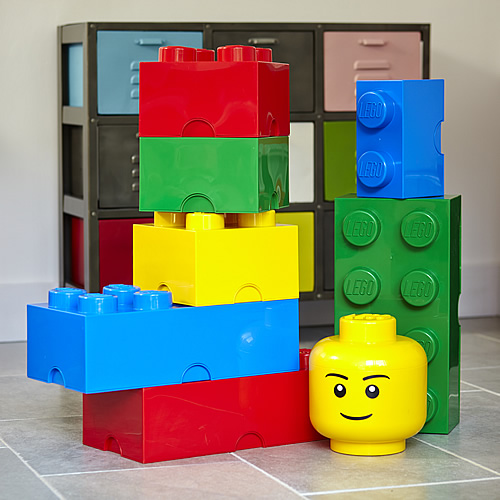
I want to click on floor, so click(55, 476).